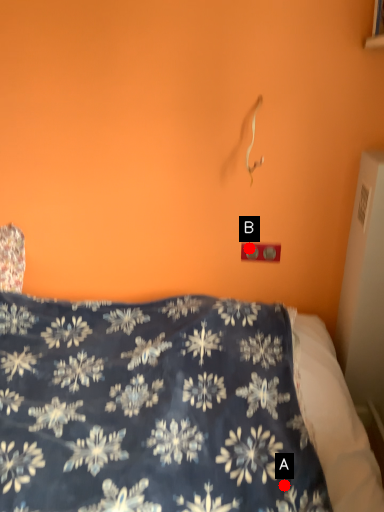
Question: Two points are circled on the image, labeled by A and B beside each circle. Which point appears farthest from the camera in this image?

Choices:
 (A) A is further
 (B) B is further

Answer: (B)